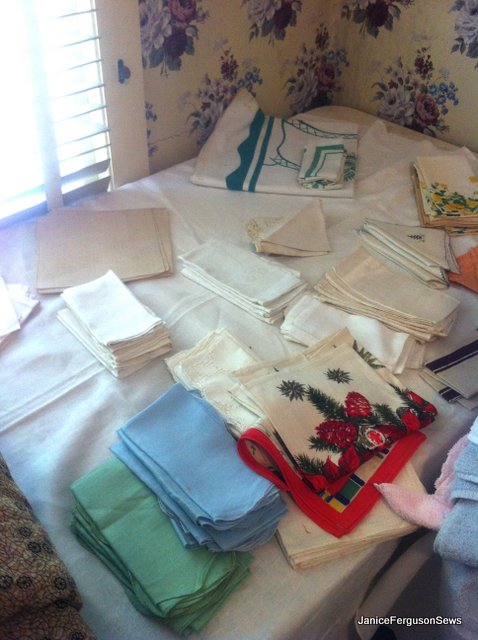
You are a GUI agent. You are given a task and a screenshot of the screen. Output one action in this format:
    pyautogui.click(x=<x>, y=<y>)
    Task: Click on the window
    
    Given the screenshot: What is the action you would take?
    tap(75, 29)